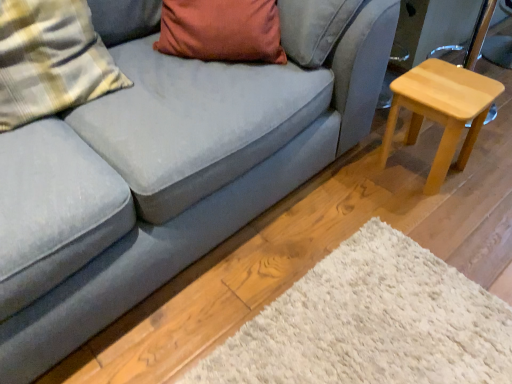
Question: From a real-world perspective, is light wood stool at right under plaid fabric pillow at left?

Choices:
 (A) no
 (B) yes

Answer: (B)

Question: Considering the relative sizes of light wood stool at right and plaid fabric pillow at left in the image provided, is light wood stool at right shorter than plaid fabric pillow at left?

Choices:
 (A) no
 (B) yes

Answer: (B)

Question: Considering the relative sizes of light wood stool at right and plaid fabric pillow at left in the image provided, is light wood stool at right taller than plaid fabric pillow at left?

Choices:
 (A) no
 (B) yes

Answer: (A)

Question: Does light wood stool at right have a smaller size compared to plaid fabric pillow at left?

Choices:
 (A) no
 (B) yes

Answer: (B)

Question: Is light wood stool at right in front of plaid fabric pillow at left?

Choices:
 (A) no
 (B) yes

Answer: (A)

Question: Considering the relative sizes of light wood stool at right and plaid fabric pillow at left in the image provided, is light wood stool at right thinner than plaid fabric pillow at left?

Choices:
 (A) yes
 (B) no

Answer: (B)

Question: From the image's perspective, is plaid fabric pillow at left beneath light wood stool at right?

Choices:
 (A) no
 (B) yes

Answer: (A)

Question: Is plaid fabric pillow at left next to light wood stool at right and touching it?

Choices:
 (A) no
 (B) yes

Answer: (A)

Question: Is plaid fabric pillow at left located outside light wood stool at right?

Choices:
 (A) yes
 (B) no

Answer: (A)

Question: Is light wood stool at right completely or partially inside plaid fabric pillow at left?

Choices:
 (A) no
 (B) yes

Answer: (A)

Question: Does plaid fabric pillow at left have a greater height compared to light wood stool at right?

Choices:
 (A) yes
 (B) no

Answer: (A)

Question: Does plaid fabric pillow at left come in front of light wood stool at right?

Choices:
 (A) no
 (B) yes

Answer: (B)

Question: From a real-world perspective, is plaid fabric pillow at left physically located above or below light wood stool at right?

Choices:
 (A) below
 (B) above

Answer: (B)